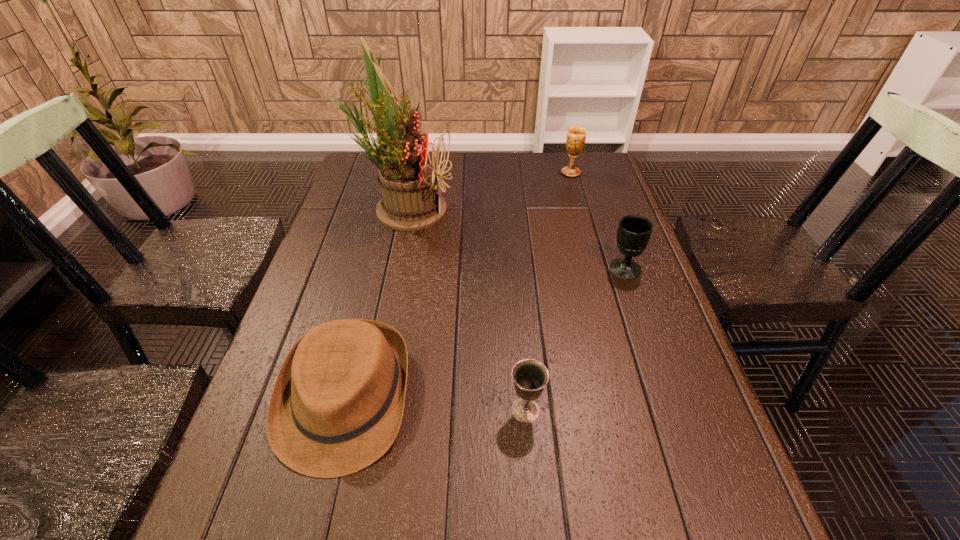
The image size is (960, 540). I want to click on free spot between the fourth nearest object and the farthest chalice, so pyautogui.click(x=487, y=191).

Locate which object ranks second in proximity to the farthest chalice. Please provide its 2D coordinates. Your answer should be formatted as a tuple, i.e. [(x, y)], where the tuple contains the x and y coordinates of a point satisfying the conditions above.

[(634, 231)]

At what (x,y) coordinates should I click in order to perform the action: click on object that stands as the second closest to the fedora. Please return your answer as a coordinate pair (x, y). Looking at the image, I should click on (408, 180).

Identify which chalice is the second nearest to the nearest chalice. Please provide its 2D coordinates. Your answer should be formatted as a tuple, i.e. [(x, y)], where the tuple contains the x and y coordinates of a point satisfying the conditions above.

[(576, 136)]

Locate which chalice is the third closest to the second farthest object. Please provide its 2D coordinates. Your answer should be formatted as a tuple, i.e. [(x, y)], where the tuple contains the x and y coordinates of a point satisfying the conditions above.

[(530, 376)]

What are the coordinates of `vacant space that satisfies the following two spatial constraints: 1. in front of the nearest chalice with the fan visible; 2. on the right side of the fourth nearest object` in the screenshot? It's located at (360, 410).

I want to click on vacant point that satisfies the following two spatial constraints: 1. on the back side of the second farthest chalice; 2. in front of the fourth nearest object with the fan visible, so click(604, 208).

Identify the location of blank area in the image that satisfies the following two spatial constraints: 1. in front of the fourth nearest object with the fan visible; 2. on the left side of the second farthest chalice. The width and height of the screenshot is (960, 540). (391, 269).

The height and width of the screenshot is (540, 960). Find the location of `vacant space that satisfies the following two spatial constraints: 1. in front of the fourth nearest object with the fan visible; 2. on the back side of the leftmost chalice`. vacant space that satisfies the following two spatial constraints: 1. in front of the fourth nearest object with the fan visible; 2. on the back side of the leftmost chalice is located at coordinates (360, 410).